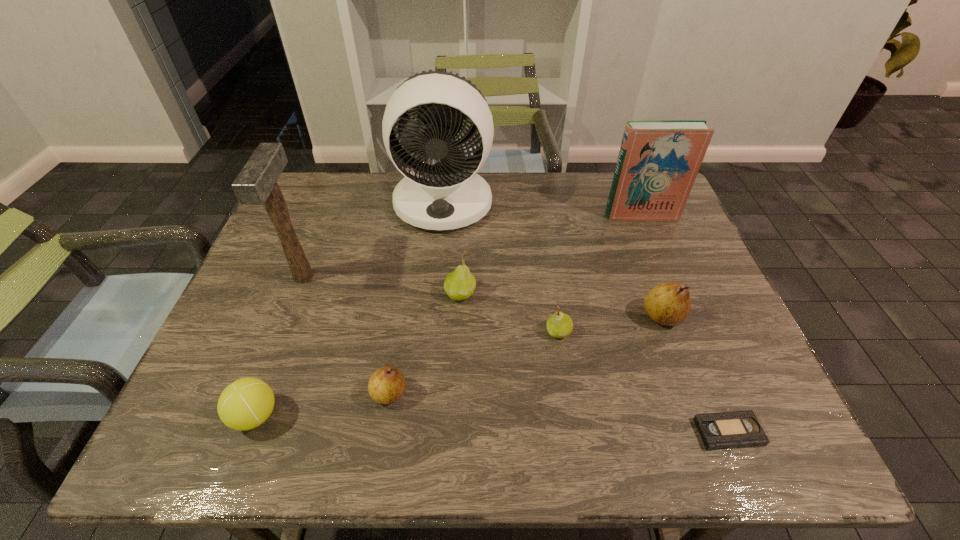
Locate an element on the screen. free spot located 0.300m on the back of the green tennis ball is located at coordinates (304, 287).

Identify the location of free space located on the left of the videotape. Image resolution: width=960 pixels, height=540 pixels. (651, 432).

Locate an element on the screen. fan present at the far edge is located at coordinates (449, 194).

Find the location of a particular element. hardback book that is positioned at the far edge is located at coordinates (658, 162).

The width and height of the screenshot is (960, 540). Identify the location of tennis ball that is at the near edge. (245, 404).

Locate an element on the screen. videotape that is positioned at the near edge is located at coordinates (738, 429).

The height and width of the screenshot is (540, 960). Find the location of `mallet that is at the left edge`. mallet that is at the left edge is located at coordinates (256, 184).

In order to click on tennis ball that is at the left edge in this screenshot , I will do `click(245, 404)`.

Locate an element on the screen. Image resolution: width=960 pixels, height=540 pixels. hardback book that is positioned at the right edge is located at coordinates (658, 162).

At what (x,y) coordinates should I click in order to perform the action: click on pear positioned at the right edge. Please return your answer as a coordinate pair (x, y). The height and width of the screenshot is (540, 960). Looking at the image, I should click on (669, 304).